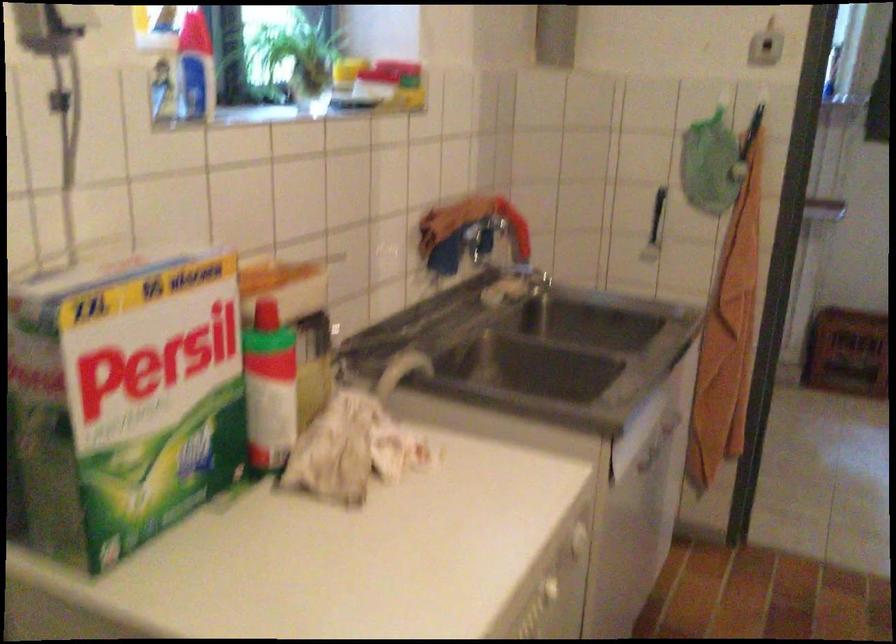
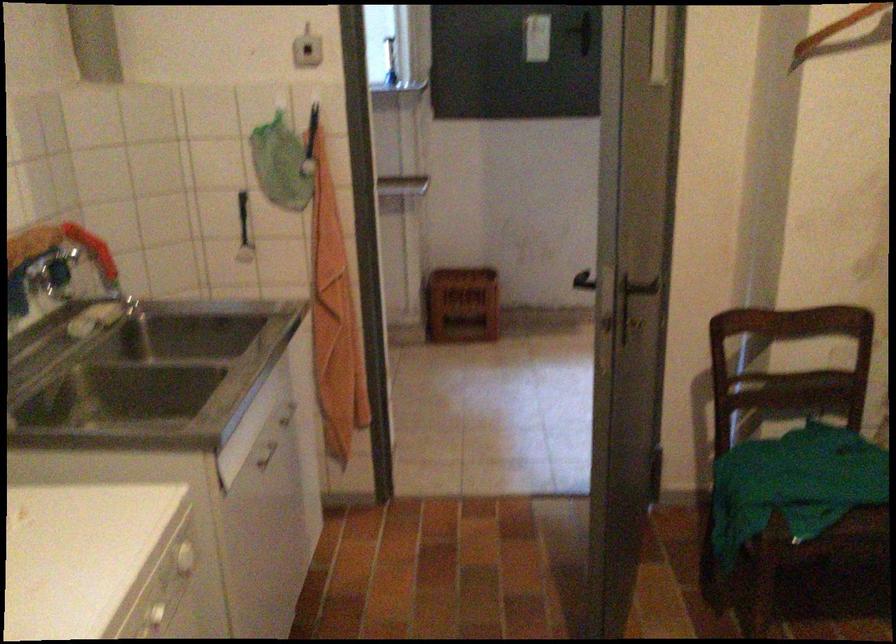
Where in the second image is the point corresponding to [512,222] from the first image?

(91, 249)